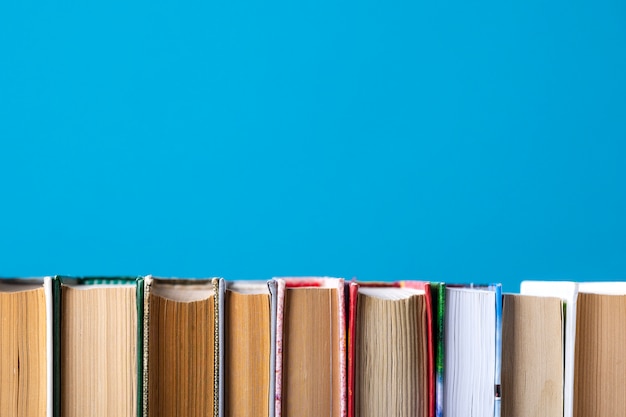
Identify the location of books. (31, 338), (91, 338), (195, 338), (254, 338), (332, 340), (386, 348), (461, 349), (529, 351), (601, 351).